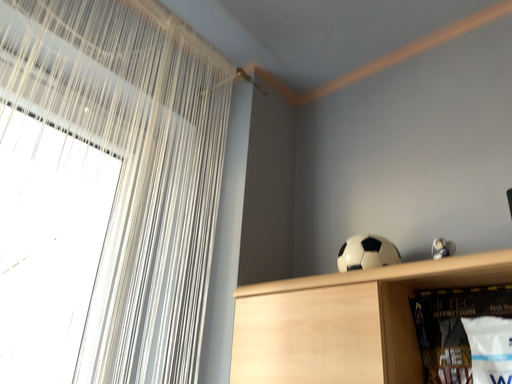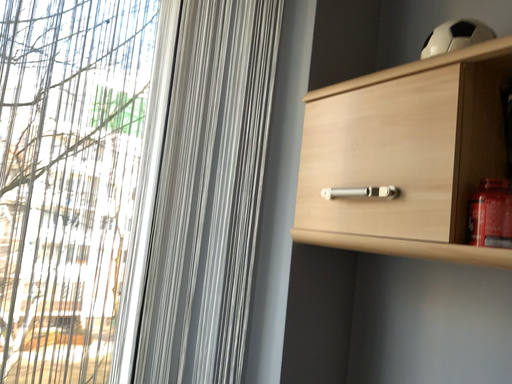
Question: How did the camera likely rotate when shooting the video?

Choices:
 (A) rotated right
 (B) rotated left

Answer: (B)